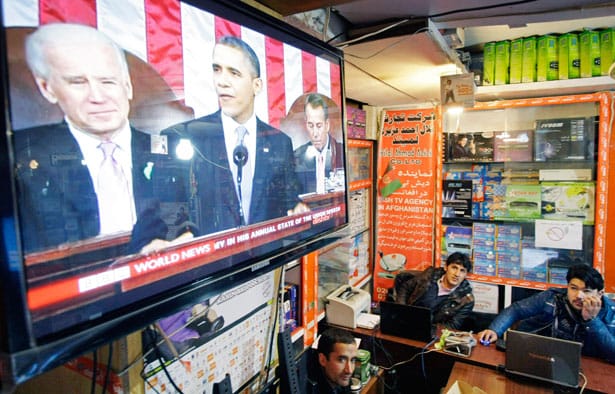
In order to click on computer in this screenshot , I will do `click(512, 350)`.